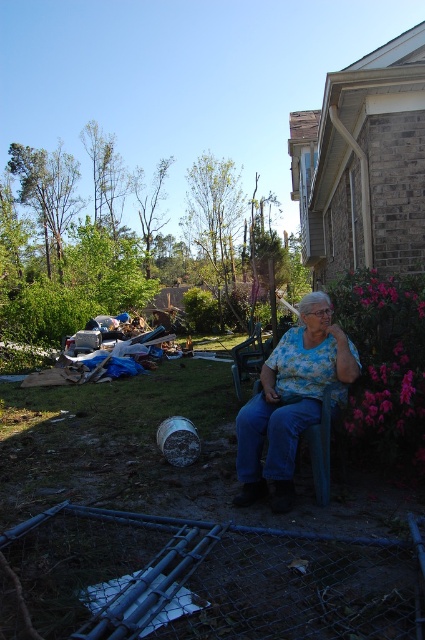
Question: Which point is closer to the camera?

Choices:
 (A) floral print blouse at center
 (B) matte plastic chair at center

Answer: (A)

Question: From the image, what is the correct spatial relationship of floral print blouse at center in relation to matte plastic chair at center?

Choices:
 (A) left
 (B) right

Answer: (B)

Question: Which of the following is the farthest from the observer?

Choices:
 (A) (255, 355)
 (B) (243, 481)

Answer: (A)

Question: Observing the image, what is the correct spatial positioning of floral print blouse at center in reference to matte plastic chair at center?

Choices:
 (A) above
 (B) below

Answer: (B)

Question: From the image, what is the correct spatial relationship of floral print blouse at center in relation to matte plastic chair at center?

Choices:
 (A) above
 (B) below

Answer: (B)